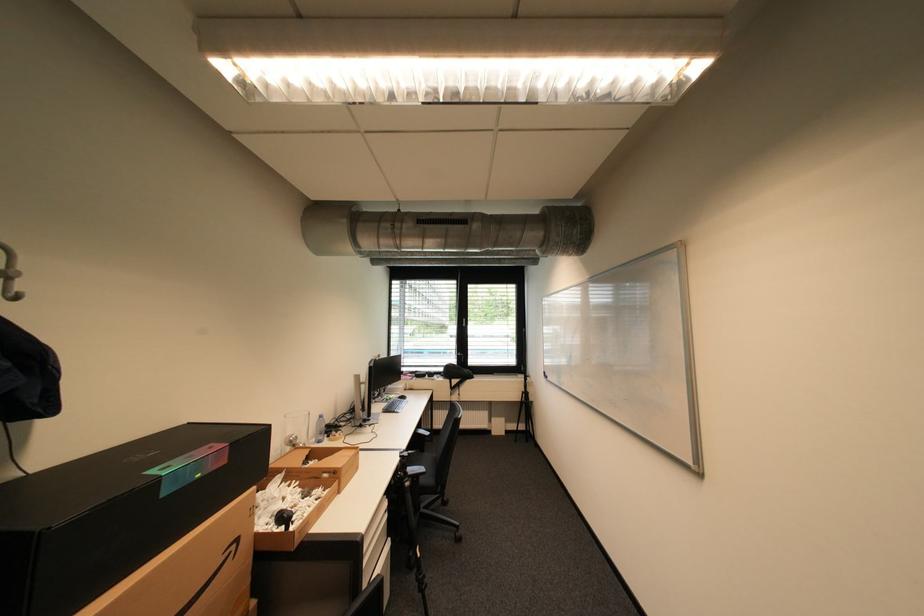
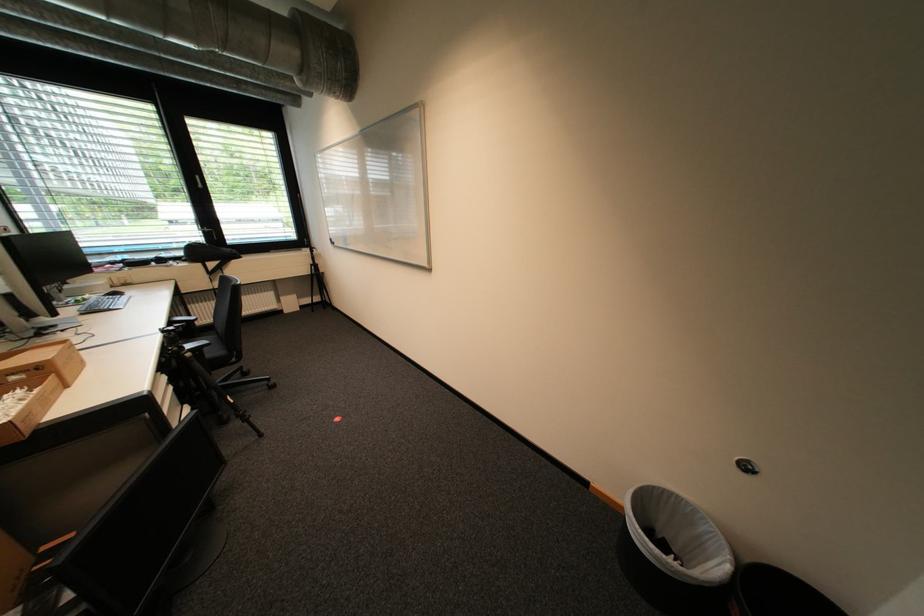
In the second image, find the point that corresponds to (x=395, y=400) in the first image.

(86, 302)